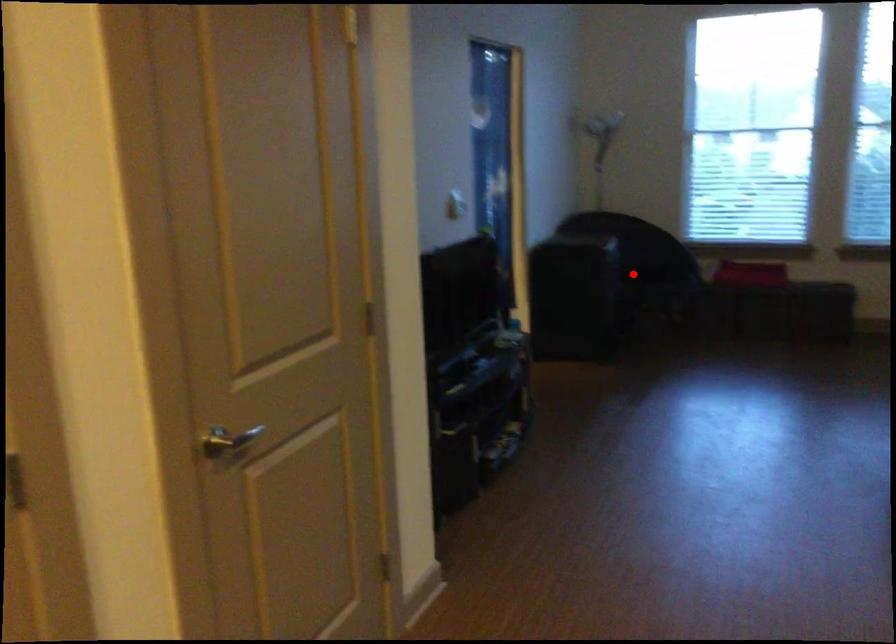
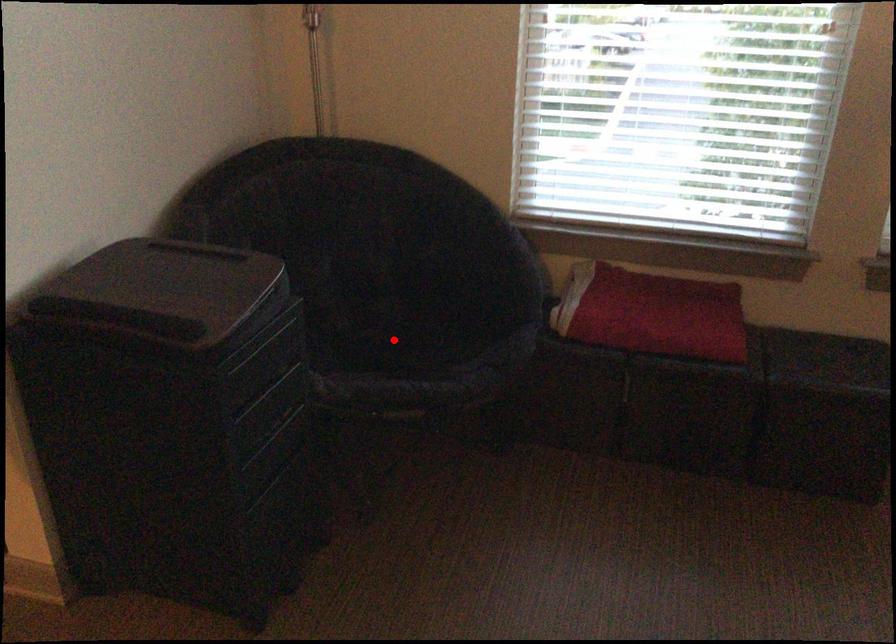
I am providing you with two images of the same scene from different viewpoints. A red point is marked on the first image and another point is marked on the second image. Is the marked point in image1 the same physical position as the marked point in image2?

Yes